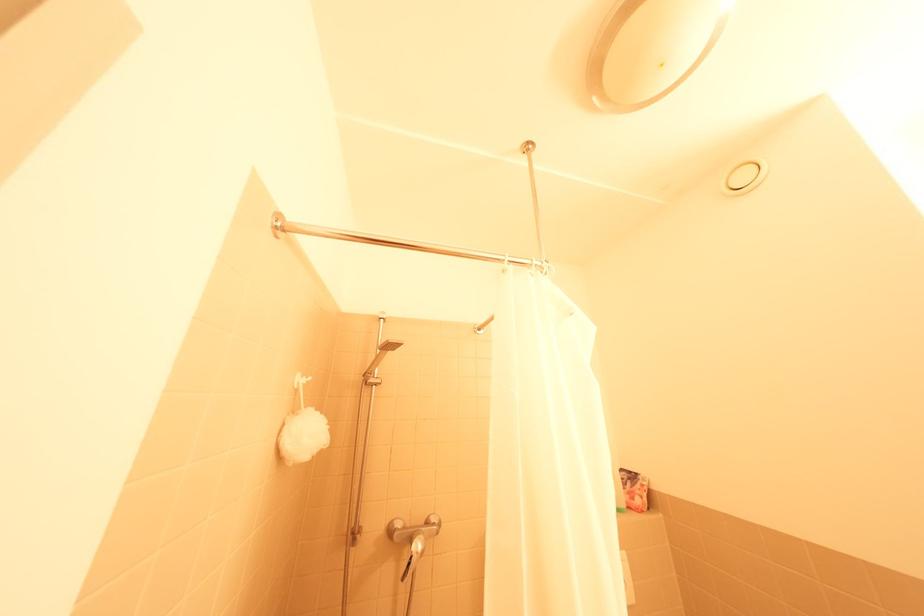
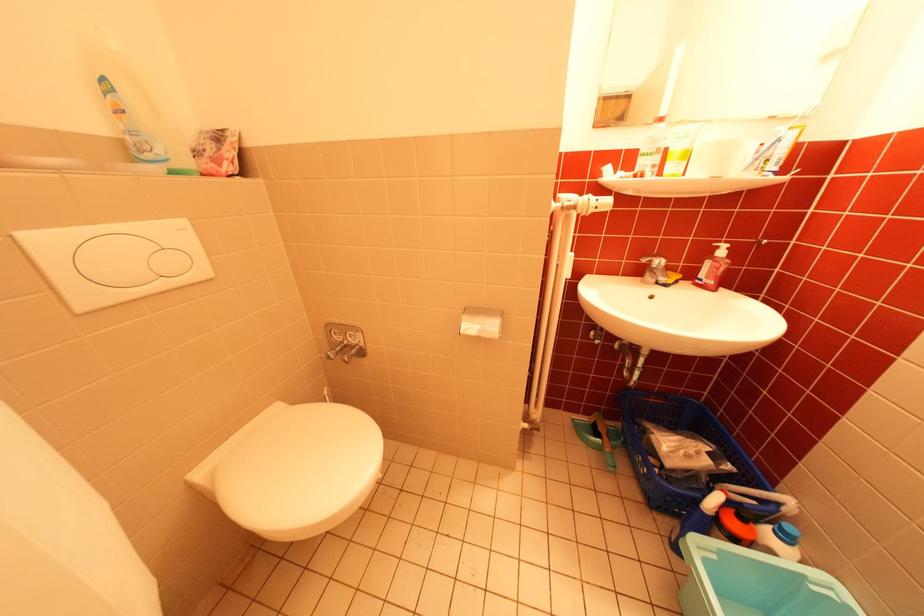
The first image is from the beginning of the video and the second image is from the end. How did the camera likely rotate when shooting the video?

The camera's rotation is toward right-down.